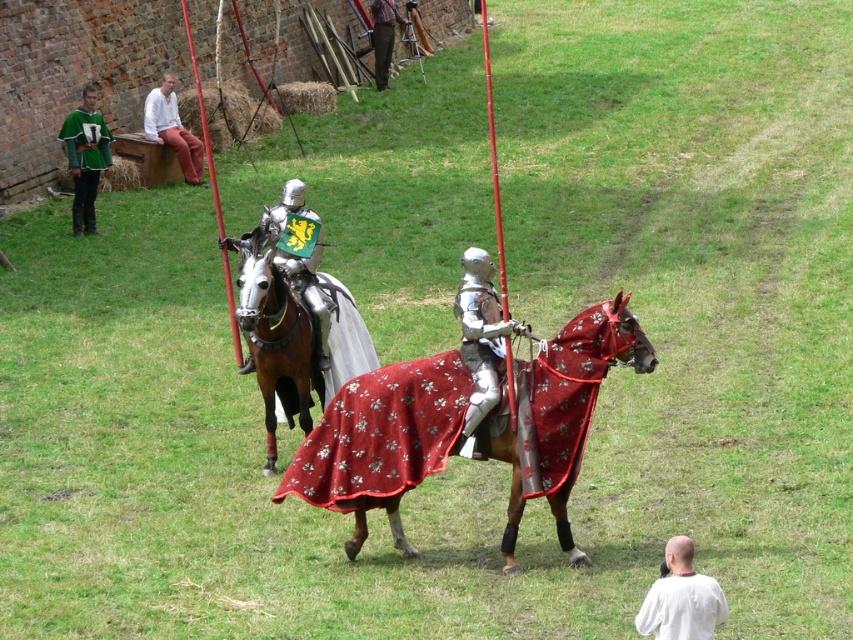
You are a photographer at the medieval event. You want to take a photo that includes both the green jersey at left and the white matte shirt at lower right. Which of the two should you focus on first to ensure both are in clear view?

The green jersey at left is further to the viewer than the white matte shirt at lower right, so you should focus on the green jersey at left first to ensure both are in clear view.

You are a knight in the medieval event. You see the polished silver armor at center and the green jersey at left. Which one is closer to the brick wall in the background?

The green jersey at left is closer to the brick wall in the background because the polished silver armor at center is positioned on the right side of it, meaning the green jersey is nearer to the wall.